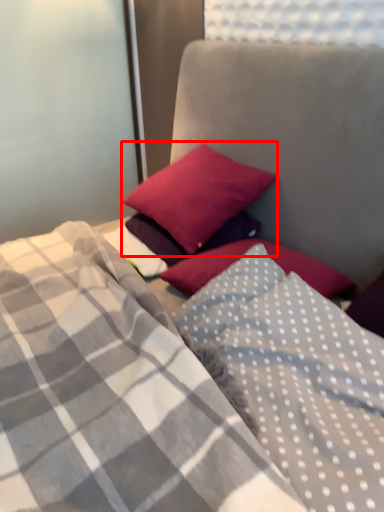
Question: From the image's perspective, where is pillow (annotated by the red box) located relative to pillow?

Choices:
 (A) below
 (B) above

Answer: (B)